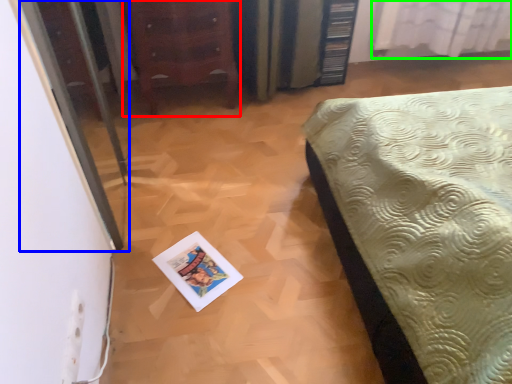
Question: Estimate the real-world distances between objects in this image. Which object is closer to furniture (highlighted by a red box), screen door (highlighted by a blue box) or curtain (highlighted by a green box)?

Choices:
 (A) screen door
 (B) curtain

Answer: (A)